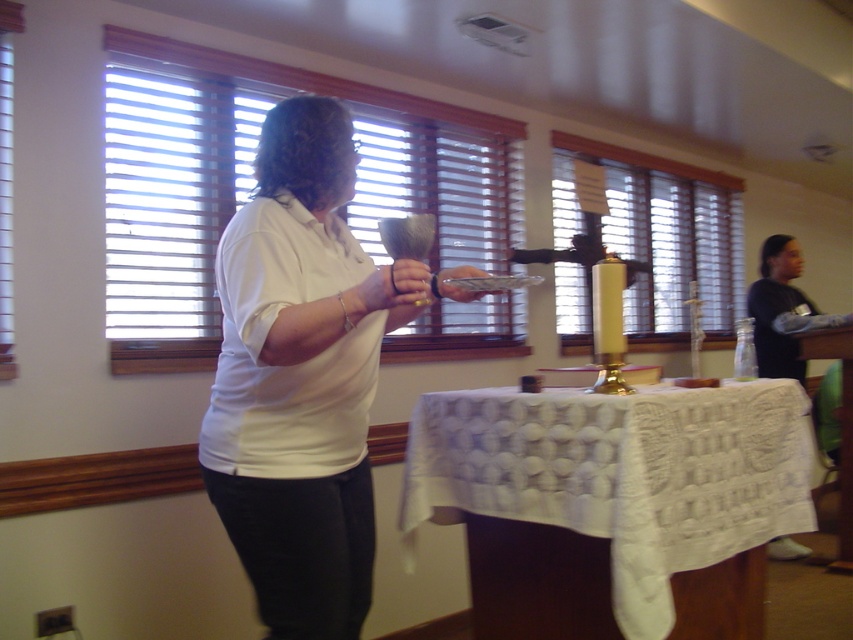
Looking at this image, you are a photographer setting up for a ceremony. You need to ensure that the white matte shirt at center and the white lace tablecloth at center are both visible in the shot. Based on their positions, which one will appear higher in the photo?

The white matte shirt at center is above the white lace tablecloth at center, so it will appear higher in the photo.

You are a photographer positioned at the center of the room. You want to capture a closeup shot of the white lace tablecloth at center without including the white matte shirt at center in the frame. Given your current position, is the distance between them sufficient to allow you to zoom in on the tablecloth while excluding the shirt?

The distance between the white matte shirt at center and the white lace tablecloth at center is 25.82 inches. Since the photographer is at the center, adjusting the zoom should allow focusing on the white lace tablecloth at center while excluding the white matte shirt at center, as the separation is sufficient.